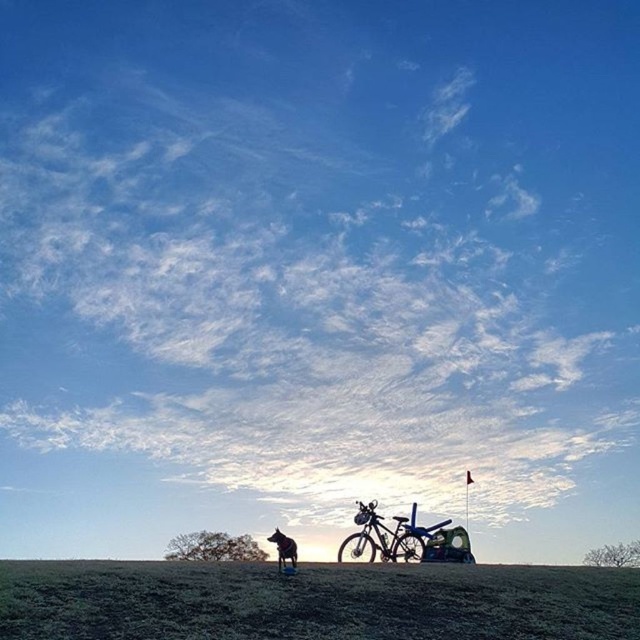
You are standing in the middle of the green grassy field at lower center and want to walk to the shiny metallic bicycle at center. Which direction should you walk to reach the bicycle?

You should walk to the right because the green grassy field at lower center is to the left of the shiny metallic bicycle at center, so moving right from the field will lead you towards the bicycle.

You are an observer standing in the middle of the green grassy field at lower center and looking towards the shiny black dog at lower center. Which object is bigger in your view?

The green grassy field at lower center is larger in size than the shiny black dog at lower center, so the green grassy field at lower center appears bigger in your view.